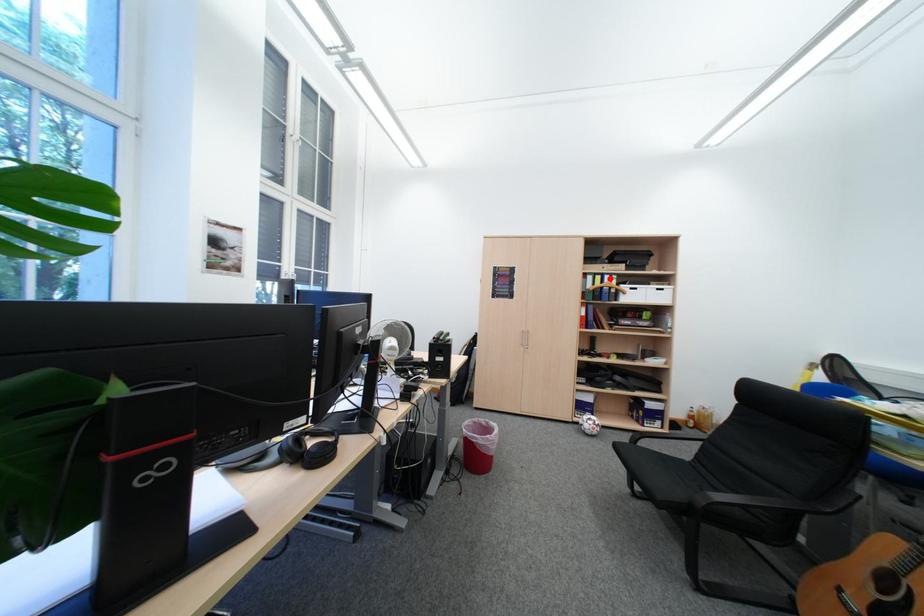
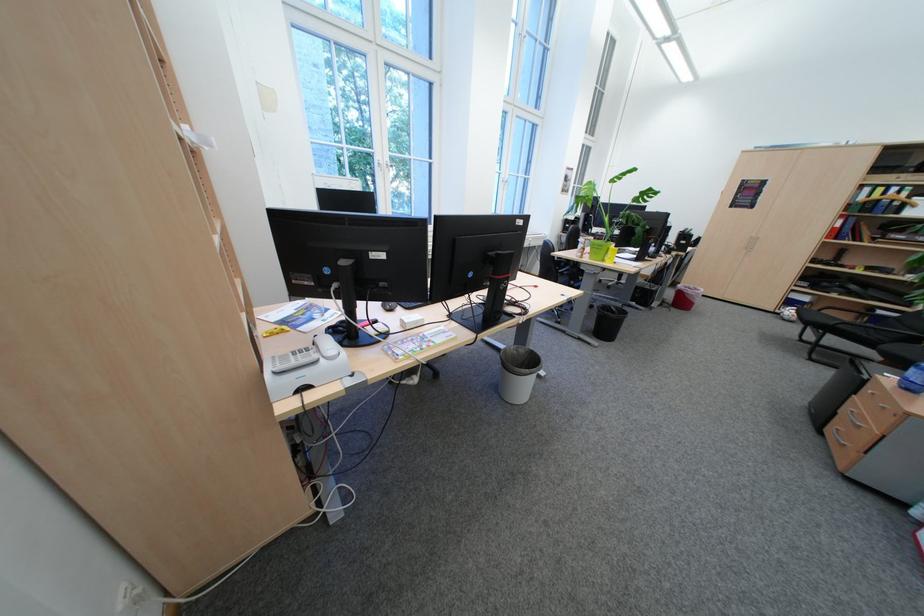
Find the pixel in the second image that matches the highlighted location in the first image.

(893, 190)